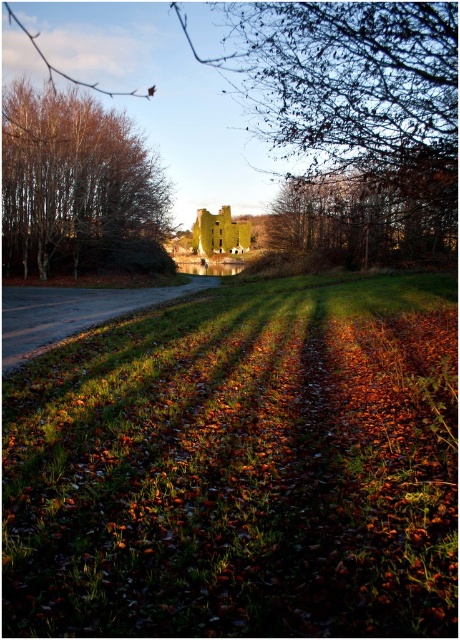
Question: Which object is positioned farthest from the green grass at center?

Choices:
 (A) green stone building at center
 (B) brown leafy tree at left

Answer: (B)

Question: Which point is closer to the camera?

Choices:
 (A) (36, 186)
 (B) (245, 554)

Answer: (B)

Question: Which point appears farthest from the camera in this image?

Choices:
 (A) (35, 100)
 (B) (454, 17)
 (C) (55, 550)

Answer: (A)

Question: Considering the relative positions of green stone building at center and brown leafy tree at left in the image provided, where is green stone building at center located with respect to brown leafy tree at left?

Choices:
 (A) right
 (B) left

Answer: (A)

Question: Can you confirm if green grass at center is positioned above brown leafy tree at left?

Choices:
 (A) yes
 (B) no

Answer: (B)

Question: Is green grass at center above green stone building at center?

Choices:
 (A) yes
 (B) no

Answer: (B)